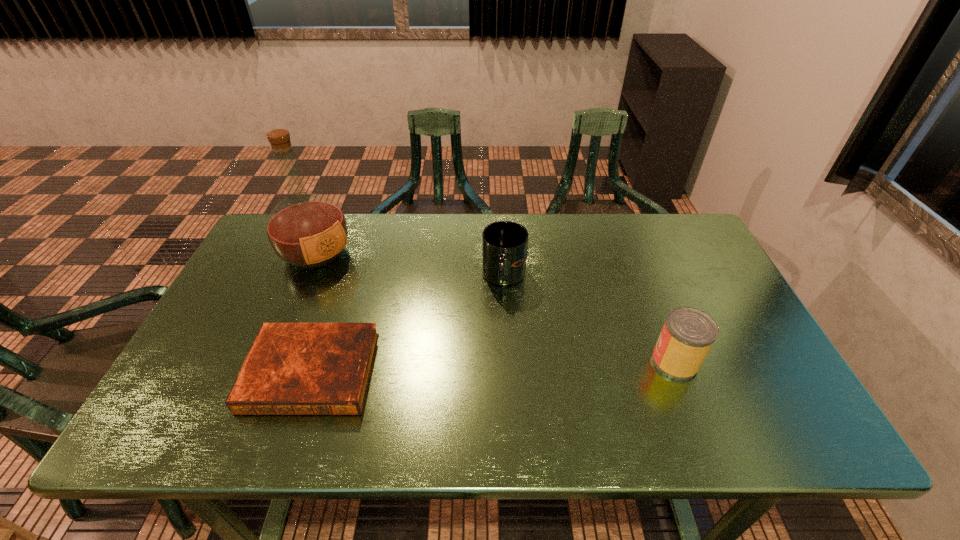
Locate an element on the screen. This screenshot has width=960, height=540. blank area located on the front label of the liquor is located at coordinates (355, 288).

The image size is (960, 540). In order to click on mug located at the far edge in this screenshot , I will do `click(504, 243)`.

Find the location of `liquor at the far edge`. liquor at the far edge is located at coordinates (306, 230).

Identify the location of Bible positioned at the near edge. (292, 368).

Where is `can that is at the near edge`? The image size is (960, 540). can that is at the near edge is located at coordinates (688, 333).

Where is `object located in the left edge section of the desktop`? The image size is (960, 540). object located in the left edge section of the desktop is located at coordinates (306, 230).

What are the coordinates of `object that is at the far left corner` in the screenshot? It's located at (306, 230).

The image size is (960, 540). In order to click on vacant space at the far edge of the desktop in this screenshot , I will do `click(395, 254)`.

The image size is (960, 540). In the image, there is a desktop. Identify the location of free space at the near edge. (x=374, y=389).

At what (x,y) coordinates should I click in order to perform the action: click on vacant region at the left edge of the desktop. Please return your answer as a coordinate pair (x, y). Looking at the image, I should click on (281, 289).